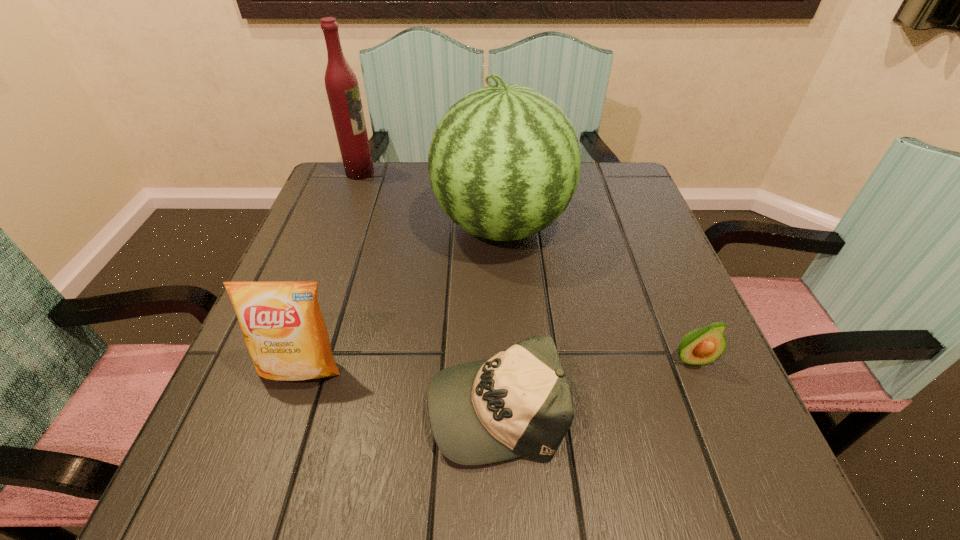
Where is `free space located 0.080m on the front-facing side of the baseball cap`? Image resolution: width=960 pixels, height=540 pixels. free space located 0.080m on the front-facing side of the baseball cap is located at coordinates (377, 405).

Image resolution: width=960 pixels, height=540 pixels. Find the location of `free location located 0.090m on the front-facing side of the baseball cap`. free location located 0.090m on the front-facing side of the baseball cap is located at coordinates tap(372, 405).

Identify the location of liquor at the far edge. (341, 84).

Locate an element on the screen. This screenshot has height=540, width=960. watermelon that is at the far edge is located at coordinates (504, 162).

Image resolution: width=960 pixels, height=540 pixels. Identify the location of object located at the near edge. (518, 403).

Find the location of a particular element. The width and height of the screenshot is (960, 540). liquor located at the left edge is located at coordinates (341, 84).

This screenshot has width=960, height=540. What are the coordinates of `crisp (potato chip) that is at the left edge` in the screenshot? It's located at (282, 324).

Find the location of `object situated at the right edge`. object situated at the right edge is located at coordinates click(x=702, y=346).

Where is `object at the far left corner`? object at the far left corner is located at coordinates (341, 84).

Locate an element on the screen. Image resolution: width=960 pixels, height=540 pixels. vacant space at the left edge of the desktop is located at coordinates (258, 376).